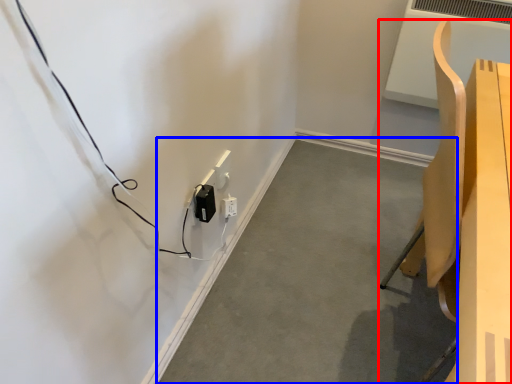
Question: Which of the following is the farthest to the observer, furniture (highlighted by a red box) or concrete (highlighted by a blue box)?

Choices:
 (A) furniture
 (B) concrete

Answer: (B)